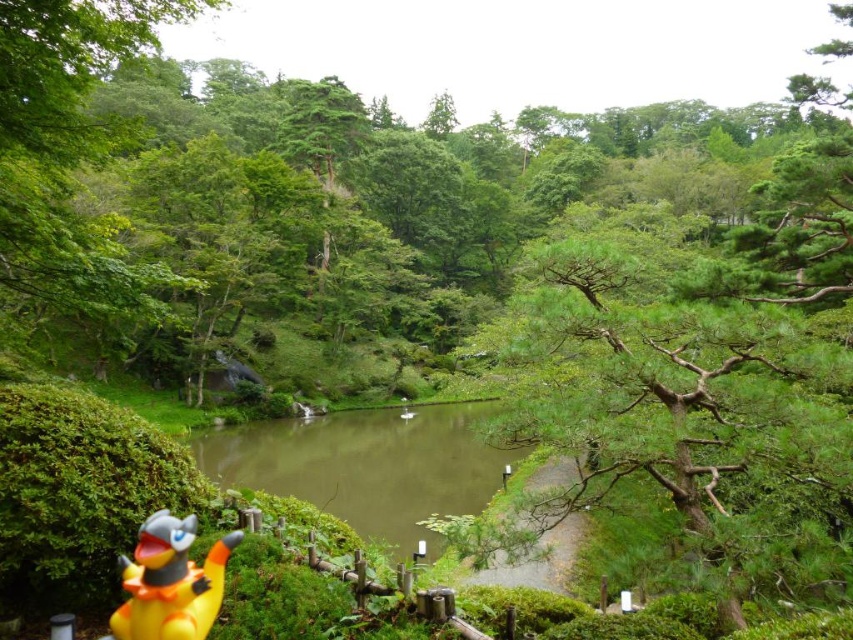
Is green murky water at center smaller than yellow rubber duck at lower left?

No, green murky water at center is not smaller than yellow rubber duck at lower left.

The image size is (853, 640). What do you see at coordinates (367, 465) in the screenshot?
I see `green murky water at center` at bounding box center [367, 465].

Who is more forward, (x=318, y=477) or (x=122, y=570)?

Point (x=122, y=570)

The height and width of the screenshot is (640, 853). I want to click on green murky water at center, so click(x=367, y=465).